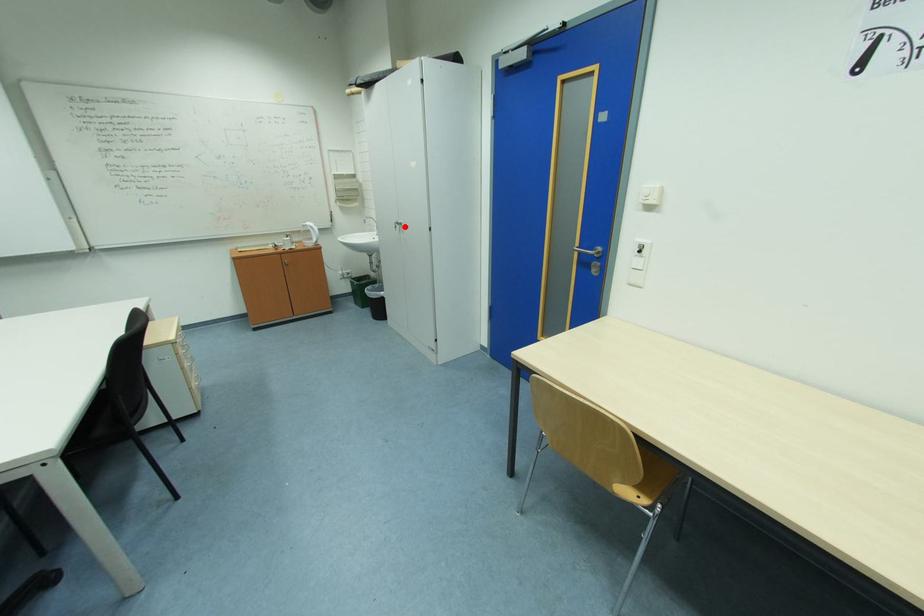
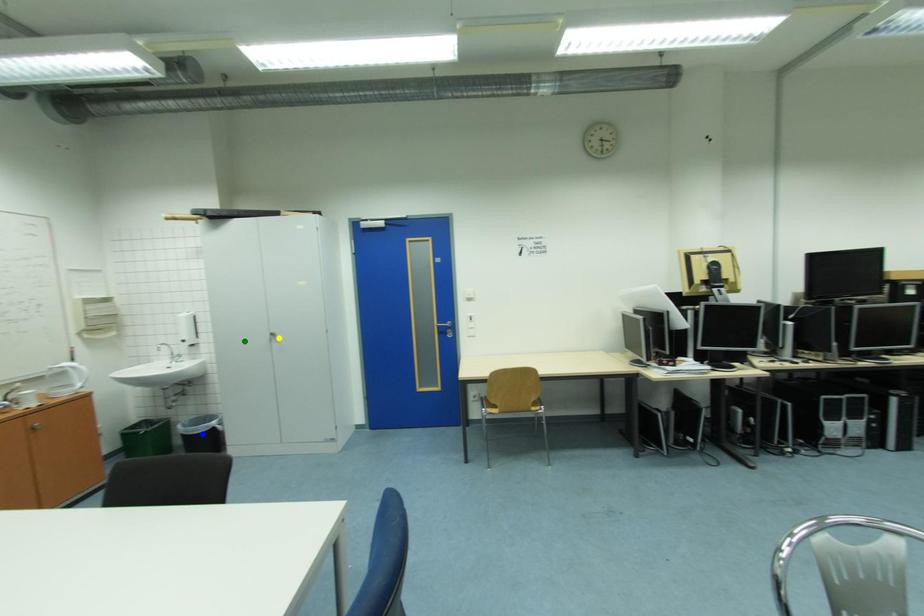
Question: I am providing you with two images of the same scene from different viewpoints. A red point is marked on the first image. You are given multiple points on the second image. In image 2, which mark is for the same physical point as the one in image 1?

Choices:
 (A) yellow point
 (B) green point
 (C) blue point

Answer: (A)